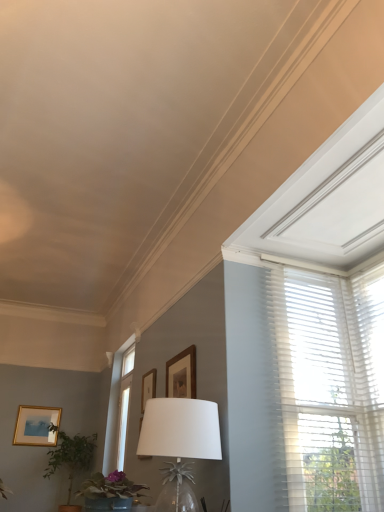
What is the approximate width of matte gold picture frame at lower left, which ranks as the 3th picture frame in front-to-back order?

matte gold picture frame at lower left, which ranks as the 3th picture frame in front-to-back order, is 1.61 inches in width.

What do you see at coordinates (36, 426) in the screenshot? I see `matte gold picture frame at lower left, the 3th picture frame when ordered from right to left` at bounding box center [36, 426].

You are a GUI agent. You are given a task and a screenshot of the screen. Output one action in this format:
    pyautogui.click(x=<x>, y=<y>)
    Task: Click on the wooden picture frame at upper center, which is the 3th picture frame from back to front
    
    Given the screenshot: What is the action you would take?
    pyautogui.click(x=182, y=374)

I want to click on green matte plant at lower left, the 2th houseplant when ordered from left to right, so click(x=109, y=492).

Find the location of `wooden picture frame at upper center, which appears as the 2th picture frame when viewed from the back`. wooden picture frame at upper center, which appears as the 2th picture frame when viewed from the back is located at coordinates (148, 387).

From a real-world perspective, relative to white sheer blinds at upper right, is green leafy plant at lower left, which is counted as the first houseplant, starting from the left, vertically above or below?

In terms of real-world spatial position, green leafy plant at lower left, which is counted as the first houseplant, starting from the left, is below white sheer blinds at upper right.

How much distance is there between green leafy plant at lower left, which is counted as the first houseplant, starting from the left, and white sheer blinds at upper right?

3.24 meters.

Considering the sizes of green leafy plant at lower left, the first houseplant viewed from the back, and white sheer blinds at upper right in the image, is green leafy plant at lower left, the first houseplant viewed from the back, bigger or smaller than white sheer blinds at upper right?

Considering their sizes, green leafy plant at lower left, the first houseplant viewed from the back, takes up more space than white sheer blinds at upper right.

Between green leafy plant at lower left, acting as the 2th houseplant starting from the front, and white sheer blinds at upper right, which one has larger width?

green leafy plant at lower left, acting as the 2th houseplant starting from the front.

Consider the image. Is white sheer blinds at upper right facing away from wooden picture frame at upper center, which appears as the 2th picture frame when viewed from the back?

No, white sheer blinds at upper right is not facing the opposite direction of wooden picture frame at upper center, which appears as the 2th picture frame when viewed from the back.

Which picture frame is the 2nd one when counting from the back of the white sheer blinds at upper right? Please provide its 2D coordinates.

[(148, 387)]

Considering the sizes of objects white sheer blinds at upper right and wooden picture frame at upper center, marked as the second picture frame in a bottom-to-top arrangement, in the image provided, who is shorter, white sheer blinds at upper right or wooden picture frame at upper center, marked as the second picture frame in a bottom-to-top arrangement,?

wooden picture frame at upper center, marked as the second picture frame in a bottom-to-top arrangement.

This screenshot has width=384, height=512. I want to click on table lamp lying above the matte gold picture frame at lower left, which ranks as the 3th picture frame in front-to-back order (from the image's perspective), so click(180, 429).

Is white glass table lamp at center at the right side of matte gold picture frame at lower left, which is counted as the first picture frame, starting from the left?

Correct, you'll find white glass table lamp at center to the right of matte gold picture frame at lower left, which is counted as the first picture frame, starting from the left.

Which is more to the right, green matte plant at lower left, placed as the second houseplant when sorted from back to front, or white glass table lamp at center?

white glass table lamp at center.

Is green matte plant at lower left, the 2th houseplant when ordered from left to right, taller than white glass table lamp at center?

No.

From the image's perspective, is green leafy plant at lower left, which is counted as the first houseplant, starting from the left, over white glass table lamp at center?

No, from the image's perspective, green leafy plant at lower left, which is counted as the first houseplant, starting from the left, is not on top of white glass table lamp at center.

Considering the sizes of objects green leafy plant at lower left, marked as the second houseplant in a top-to-bottom arrangement, and white glass table lamp at center in the image provided, who is thinner, green leafy plant at lower left, marked as the second houseplant in a top-to-bottom arrangement, or white glass table lamp at center?

white glass table lamp at center is thinner.

Based on their positions, is green leafy plant at lower left, marked as the second houseplant in a top-to-bottom arrangement, located to the left or right of white glass table lamp at center?

green leafy plant at lower left, marked as the second houseplant in a top-to-bottom arrangement, is to the left of white glass table lamp at center.

Locate an element on the screen. The image size is (384, 512). table lamp above the green leafy plant at lower left, which is counted as the first houseplant, starting from the left (from the image's perspective) is located at coordinates (180, 429).

Can you tell me how much green matte plant at lower left, placed as the first houseplant when sorted from top to bottom, and wooden picture frame at upper center, which is the second picture frame in left-to-right order, differ in facing direction?

The facing directions of green matte plant at lower left, placed as the first houseplant when sorted from top to bottom, and wooden picture frame at upper center, which is the second picture frame in left-to-right order, are 88.6 degrees apart.

Between green matte plant at lower left, placed as the 1th houseplant when sorted from right to left, and wooden picture frame at upper center, arranged as the 2th picture frame when viewed from the front, which one has less height?

green matte plant at lower left, placed as the 1th houseplant when sorted from right to left.

You are a GUI agent. You are given a task and a screenshot of the screen. Output one action in this format:
    pyautogui.click(x=<x>, y=<y>)
    Task: Click on the houseplant lying above the wooden picture frame at upper center, marked as the second picture frame in a bottom-to-top arrangement (from the image's perspective)
    Image resolution: width=384 pixels, height=512 pixels.
    Given the screenshot: What is the action you would take?
    pyautogui.click(x=109, y=492)

Does green matte plant at lower left, placed as the second houseplant when sorted from back to front, turn towards matte gold picture frame at lower left, which is counted as the first picture frame, starting from the left?

Yes, green matte plant at lower left, placed as the second houseplant when sorted from back to front, is facing matte gold picture frame at lower left, which is counted as the first picture frame, starting from the left.

Is green matte plant at lower left, placed as the second houseplant when sorted from back to front, far from matte gold picture frame at lower left, which ranks as the 3th picture frame in front-to-back order?

green matte plant at lower left, placed as the second houseplant when sorted from back to front, is positioned a significant distance from matte gold picture frame at lower left, which ranks as the 3th picture frame in front-to-back order.

In the scene shown: Between green matte plant at lower left, the second houseplant when ordered from bottom to top, and matte gold picture frame at lower left, placed as the 3th picture frame when sorted from top to bottom, which one has more height?

matte gold picture frame at lower left, placed as the 3th picture frame when sorted from top to bottom.

Considering the sizes of green matte plant at lower left, placed as the second houseplant when sorted from back to front, and matte gold picture frame at lower left, arranged as the first picture frame when viewed from the back, in the image, is green matte plant at lower left, placed as the second houseplant when sorted from back to front, bigger or smaller than matte gold picture frame at lower left, arranged as the first picture frame when viewed from the back,?

In the image, green matte plant at lower left, placed as the second houseplant when sorted from back to front, appears to be larger than matte gold picture frame at lower left, arranged as the first picture frame when viewed from the back.

Locate an element on the screen. The width and height of the screenshot is (384, 512). the 1st houseplant below the white sheer blinds at upper right (from a real-world perspective) is located at coordinates (70, 458).

Where is `window blind above the wooden picture frame at upper center, the second picture frame from the right (from the image's perspective)`? The width and height of the screenshot is (384, 512). window blind above the wooden picture frame at upper center, the second picture frame from the right (from the image's perspective) is located at coordinates (369, 377).

Looking at the image, which one is located further to wooden picture frame at upper center, which is the second picture frame in left-to-right order, green leafy plant at lower left, the first houseplant viewed from the back, or wooden picture frame at upper center, the 1th picture frame positioned from the right?

green leafy plant at lower left, the first houseplant viewed from the back, is further to wooden picture frame at upper center, which is the second picture frame in left-to-right order.

Considering their positions, is white glass table lamp at center positioned further to matte gold picture frame at lower left, placed as the 3th picture frame when sorted from top to bottom, than wooden picture frame at upper center, arranged as the second picture frame when viewed from the top?

Among the two, white glass table lamp at center is located further to matte gold picture frame at lower left, placed as the 3th picture frame when sorted from top to bottom.

Which object lies further to the anchor point green leafy plant at lower left, the first houseplant ordered from the bottom, wooden picture frame at upper center, arranged as the 3th picture frame when viewed from the left, or white sheer blinds at upper right?

white sheer blinds at upper right lies further to green leafy plant at lower left, the first houseplant ordered from the bottom, than the other object.

Looking at the image, which one is located further to green matte plant at lower left, the 2th houseplant when ordered from left to right, green leafy plant at lower left, the 2th houseplant viewed from the right, or matte gold picture frame at lower left, the 3th picture frame when ordered from right to left?

The object further to green matte plant at lower left, the 2th houseplant when ordered from left to right, is matte gold picture frame at lower left, the 3th picture frame when ordered from right to left.

Estimate the real-world distances between objects in this image. Which object is further from matte gold picture frame at lower left, arranged as the first picture frame when viewed from the back, green leafy plant at lower left, the first houseplant ordered from the bottom, or white sheer blinds at upper right?

Among the two, white sheer blinds at upper right is located further to matte gold picture frame at lower left, arranged as the first picture frame when viewed from the back.

Which object lies further to the anchor point green matte plant at lower left, placed as the 1th houseplant when sorted from right to left, green leafy plant at lower left, marked as the second houseplant in a top-to-bottom arrangement, or white sheer blinds at upper right?

green leafy plant at lower left, marked as the second houseplant in a top-to-bottom arrangement.

Considering their positions, is white glass table lamp at center positioned further to white sheer blinds at upper right than green matte plant at lower left, arranged as the 1th houseplant when viewed from the front?

green matte plant at lower left, arranged as the 1th houseplant when viewed from the front, is positioned further to the anchor white sheer blinds at upper right.

Based on the photo, from the image, which object appears to be nearer to white sheer blinds at upper right, wooden picture frame at upper center, which is the 3th picture frame from back to front, or white glass table lamp at center?

wooden picture frame at upper center, which is the 3th picture frame from back to front, lies closer to white sheer blinds at upper right than the other object.

Find the location of a particular element. Image resolution: width=384 pixels, height=512 pixels. table lamp located between wooden picture frame at upper center, arranged as the 3th picture frame when viewed from the left, and white sheer blinds at upper right in the left-right direction is located at coordinates (x=180, y=429).

Locate an element on the screen. The height and width of the screenshot is (512, 384). window blind located between white glass table lamp at center and green leafy plant at lower left, the 2th houseplant viewed from the right, in the depth direction is located at coordinates (369, 377).

Locate an element on the screen. The width and height of the screenshot is (384, 512). houseplant between green matte plant at lower left, arranged as the 1th houseplant when viewed from the front, and matte gold picture frame at lower left, the 3th picture frame when ordered from right to left, along the z-axis is located at coordinates (70, 458).

You are a GUI agent. You are given a task and a screenshot of the screen. Output one action in this format:
    pyautogui.click(x=<x>, y=<y>)
    Task: Click on the window blind positioned between green matte plant at lower left, placed as the first houseplant when sorted from top to bottom, and green leafy plant at lower left, the 2th houseplant viewed from the right, from near to far
    The width and height of the screenshot is (384, 512).
    Given the screenshot: What is the action you would take?
    pyautogui.click(x=369, y=377)